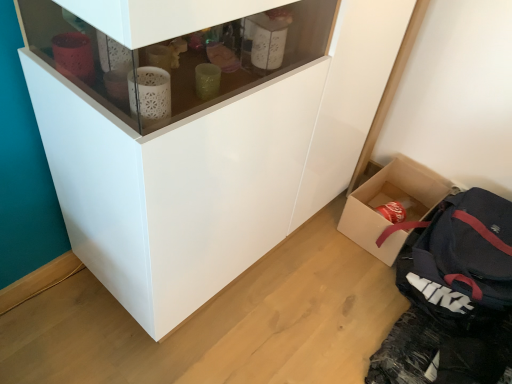
Question: Is the depth of white glossy cupboard at center less than that of dark blue fabric backpack at lower right?

Choices:
 (A) yes
 (B) no

Answer: (A)

Question: Is white glossy cupboard at center thinner than dark blue fabric backpack at lower right?

Choices:
 (A) yes
 (B) no

Answer: (A)

Question: Does white glossy cupboard at center have a greater height compared to dark blue fabric backpack at lower right?

Choices:
 (A) no
 (B) yes

Answer: (B)

Question: From a real-world perspective, is white glossy cupboard at center located higher than dark blue fabric backpack at lower right?

Choices:
 (A) yes
 (B) no

Answer: (A)

Question: Considering the relative sizes of white glossy cupboard at center and dark blue fabric backpack at lower right in the image provided, is white glossy cupboard at center wider than dark blue fabric backpack at lower right?

Choices:
 (A) yes
 (B) no

Answer: (B)

Question: Does white glossy cupboard at center come behind dark blue fabric backpack at lower right?

Choices:
 (A) no
 (B) yes

Answer: (A)

Question: From a real-world perspective, does dark blue fabric backpack at lower right stand above white glossy cupboard at center?

Choices:
 (A) yes
 (B) no

Answer: (B)

Question: Can you confirm if dark blue fabric backpack at lower right is positioned to the right of white glossy cupboard at center?

Choices:
 (A) yes
 (B) no

Answer: (A)

Question: Can we say dark blue fabric backpack at lower right lies outside white glossy cupboard at center?

Choices:
 (A) yes
 (B) no

Answer: (A)

Question: Does dark blue fabric backpack at lower right contain white glossy cupboard at center?

Choices:
 (A) yes
 (B) no

Answer: (B)

Question: From a real-world perspective, is dark blue fabric backpack at lower right physically below white glossy cupboard at center?

Choices:
 (A) yes
 (B) no

Answer: (A)

Question: Are dark blue fabric backpack at lower right and white glossy cupboard at center far apart?

Choices:
 (A) yes
 (B) no

Answer: (B)

Question: Is dark blue fabric backpack at lower right located within cardboard box at lower right?

Choices:
 (A) no
 (B) yes

Answer: (A)